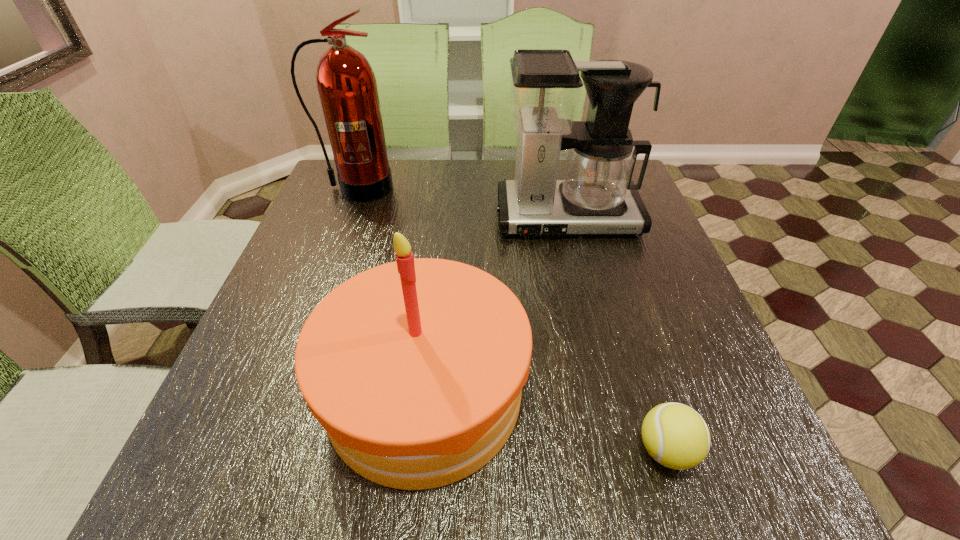
Image resolution: width=960 pixels, height=540 pixels. What are the coordinates of `fire extinguisher` in the screenshot? It's located at (347, 87).

Find the location of a particular element. coffee maker is located at coordinates (596, 196).

This screenshot has height=540, width=960. I want to click on birthday cake, so click(x=415, y=368).

You are a GUI agent. You are given a task and a screenshot of the screen. Output one action in this format:
    pyautogui.click(x=<x>, y=<y>)
    Task: Click on the tennis ball
    The width and height of the screenshot is (960, 540).
    Given the screenshot: What is the action you would take?
    pyautogui.click(x=675, y=435)

Locate an element on the screen. The image size is (960, 540). vacant region located on the front-facing side of the fire extinguisher is located at coordinates (314, 303).

The height and width of the screenshot is (540, 960). What are the coordinates of `vacant space located at the front of the coffee maker where the controls are located` in the screenshot? It's located at (587, 296).

Identify the location of vacant point located on the right of the birthday cake. (634, 392).

This screenshot has height=540, width=960. Identify the location of vacant area situated on the back of the shortest object. (631, 338).

Identify the location of fire extinguisher that is at the far edge. This screenshot has width=960, height=540. 347,87.

The height and width of the screenshot is (540, 960). What are the coordinates of `coffee maker located in the far edge section of the desktop` in the screenshot? It's located at (596, 196).